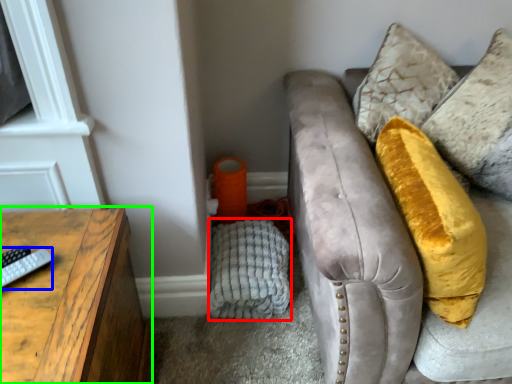
Question: Which object is positioned closest to material (highlighted by a red box)? Select from remote (highlighted by a blue box) and table (highlighted by a green box).

Choices:
 (A) remote
 (B) table

Answer: (B)